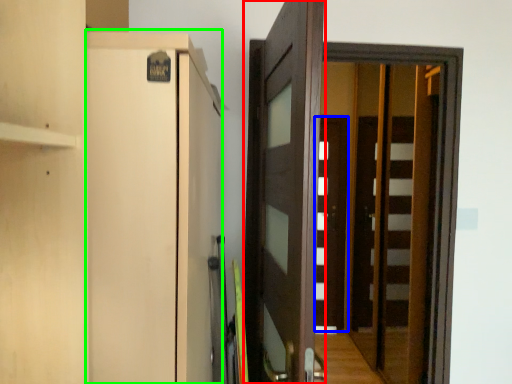
Question: Which object is the closest to the door (highlighted by a red box)? Choose among these: door (highlighted by a blue box) or cabinetry (highlighted by a green box).

Choices:
 (A) door
 (B) cabinetry

Answer: (B)